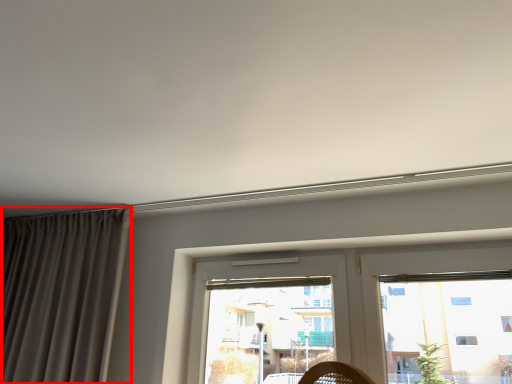
Question: From the image, what is the correct spatial relationship of curtain (annotated by the red box) in relation to window?

Choices:
 (A) right
 (B) left

Answer: (B)